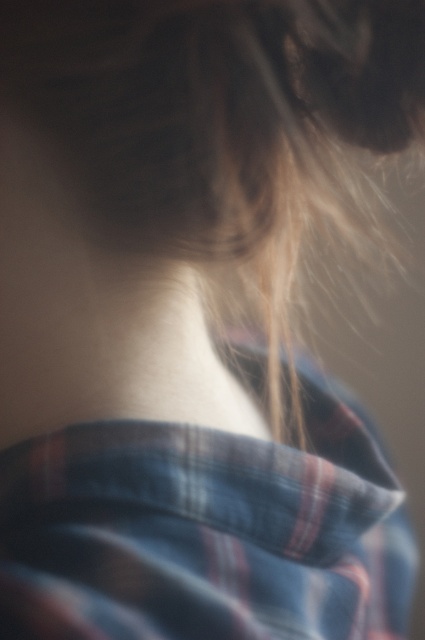
You are a photographer adjusting your camera to focus on the skinny white neck at center. You notice the plaid cotton shirt at center in the background. Which object is positioned to the right of the other?

The plaid cotton shirt at center is to the right of the skinny white neck at center.

You are an artist sketching the scene and need to place the plaid cotton shirt at center in your drawing. According to the image, what are the coordinates where you should position it?

The plaid cotton shirt at center should be positioned at coordinates (204, 532) as specified in the image.